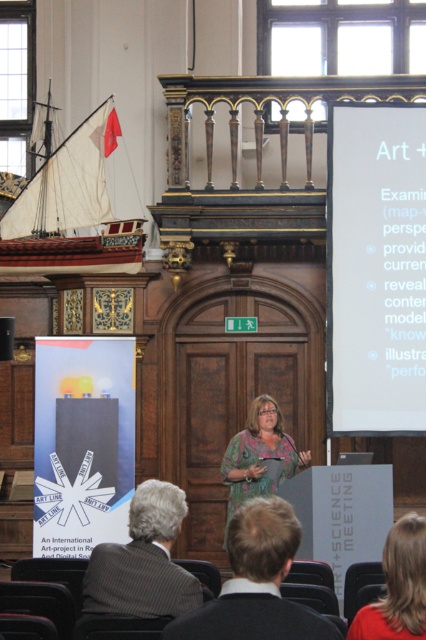
Question: Which point is closer to the camera taking this photo?

Choices:
 (A) (362, 401)
 (B) (100, 563)
 (C) (196, 618)

Answer: (C)

Question: Can you confirm if dark brown hair at lower center is positioned to the left of green floral dress at center?

Choices:
 (A) no
 (B) yes

Answer: (B)

Question: Which point is closer to the camera?

Choices:
 (A) (380, 328)
 (B) (264, 564)
 (C) (396, 532)
 (D) (232, 499)

Answer: (B)

Question: Is white paper at upper right smaller than green floral dress at center?

Choices:
 (A) yes
 (B) no

Answer: (A)

Question: Among these points, which one is nearest to the camera?

Choices:
 (A) (26, 232)
 (B) (359, 246)
 (C) (425, 563)

Answer: (C)

Question: Is wooden model ship at left to the left of gray wool suit at lower left from the viewer's perspective?

Choices:
 (A) no
 (B) yes

Answer: (B)